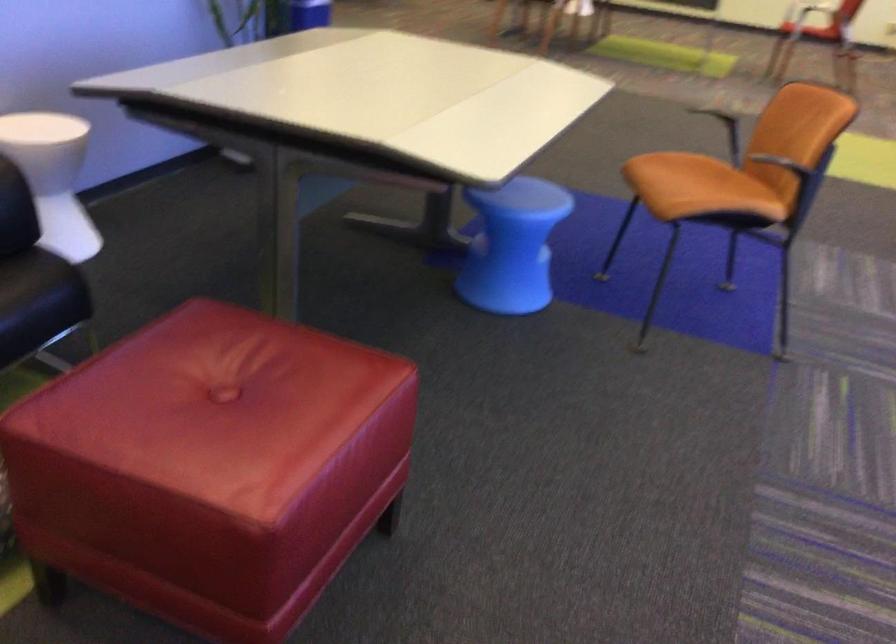
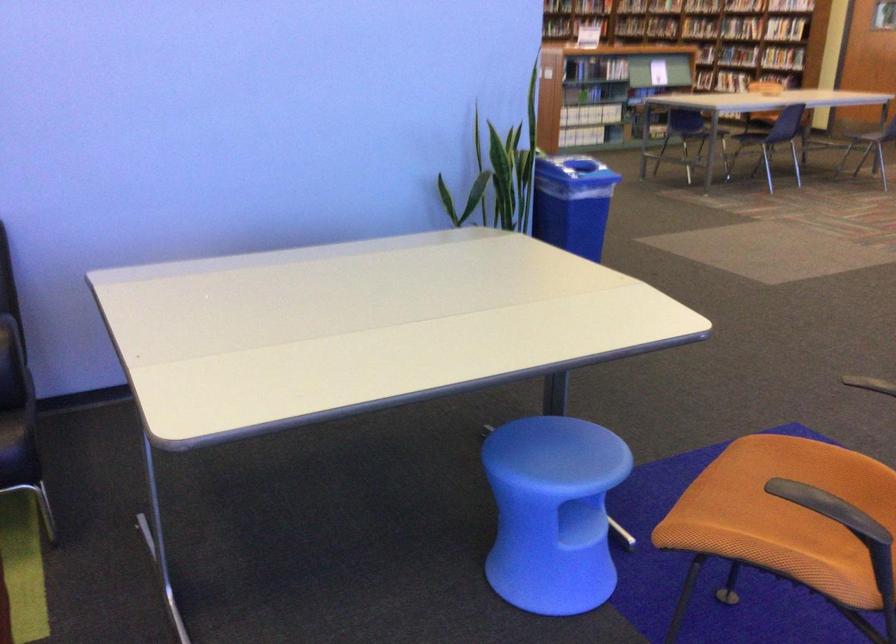
Where in the second image is the point corresponding to point 548,232 from the first image?

(553, 512)